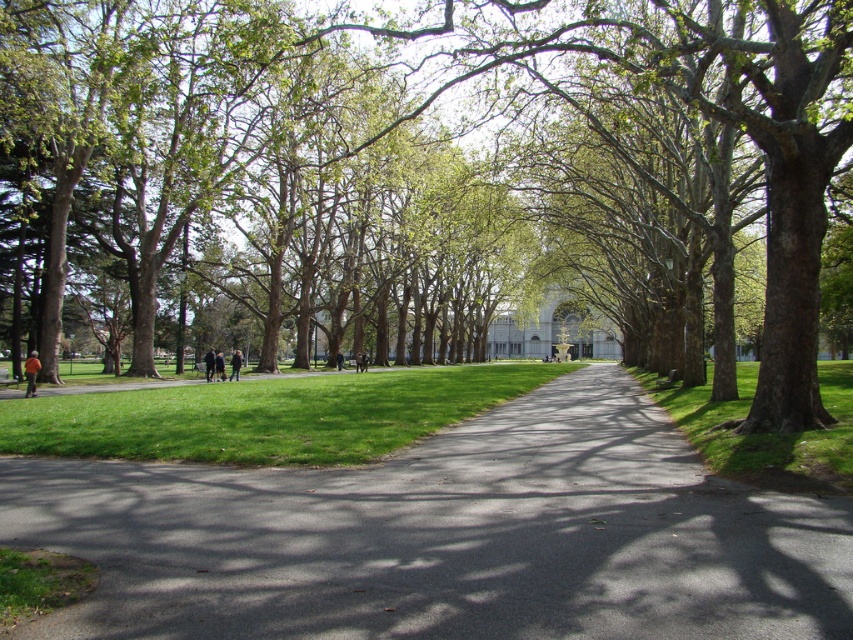
Is green grass at right bigger than dark brown leather jacket at center?

Yes, green grass at right is bigger than dark brown leather jacket at center.

Does green grass at right appear over dark brown leather jacket at center?

No.

Does point (700, 422) come in front of point (238, 349)?

Yes, point (700, 422) is in front of point (238, 349).

This screenshot has height=640, width=853. I want to click on green grass at right, so click(x=766, y=433).

Measure the distance between point (x=495, y=524) and camera.

7.46 meters

Is point (120, 548) farther from viewer compared to point (28, 372)?

No, (120, 548) is in front of (28, 372).

Who is more forward, (354, 529) or (30, 358)?

Point (354, 529) is more forward.

This screenshot has width=853, height=640. Identify the location of black asphalt road at center. (447, 538).

Which is below, green leafy tree at center or dark gray jacket at center?

Positioned lower is dark gray jacket at center.

Can you confirm if green leafy tree at center is positioned to the left of dark gray jacket at center?

No, green leafy tree at center is not to the left of dark gray jacket at center.

Locate an element on the screen. Image resolution: width=853 pixels, height=640 pixels. green leafy tree at center is located at coordinates (712, 118).